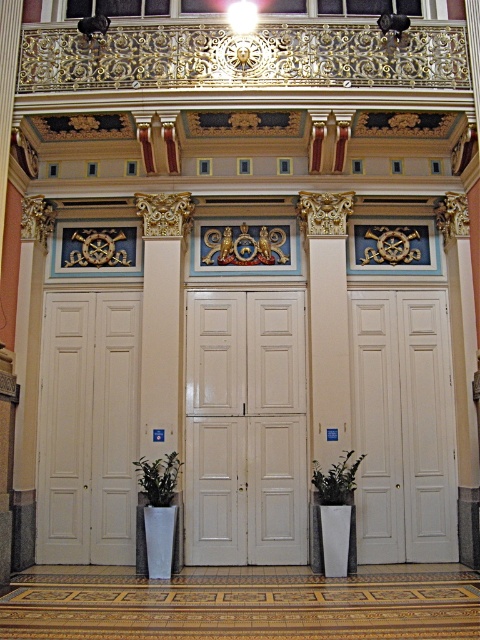
Does white matte door at center appear on the left side of white matte door at left?

In fact, white matte door at center is to the right of white matte door at left.

Can you confirm if white matte door at center is smaller than white matte door at left?

Indeed, white matte door at center has a smaller size compared to white matte door at left.

Who is more distant from viewer, (369, 560) or (76, 547)?

Point (76, 547)

Identify the location of white matte door at center. This screenshot has height=640, width=480. (404, 426).

Can you confirm if green leafy plant in white pot at lower left is wider than green matte plant at center?

In fact, green leafy plant in white pot at lower left might be narrower than green matte plant at center.

Between green leafy plant in white pot at lower left and green matte plant at center, which one is positioned lower?

green leafy plant in white pot at lower left is below.

The height and width of the screenshot is (640, 480). Describe the element at coordinates (158, 477) in the screenshot. I see `green leafy plant in white pot at lower left` at that location.

Where is `green leafy plant in white pot at lower left`? Image resolution: width=480 pixels, height=640 pixels. green leafy plant in white pot at lower left is located at coordinates (158, 477).

Measure the distance between white glossy door at center and camera.

10.71 meters

Between point (268, 358) and point (120, 413), which one is positioned in front?

Positioned in front is point (120, 413).

At what (x,y) coordinates should I click in order to perform the action: click on white glossy door at center. Please return your answer as a coordinate pair (x, y). Looking at the image, I should click on (244, 428).